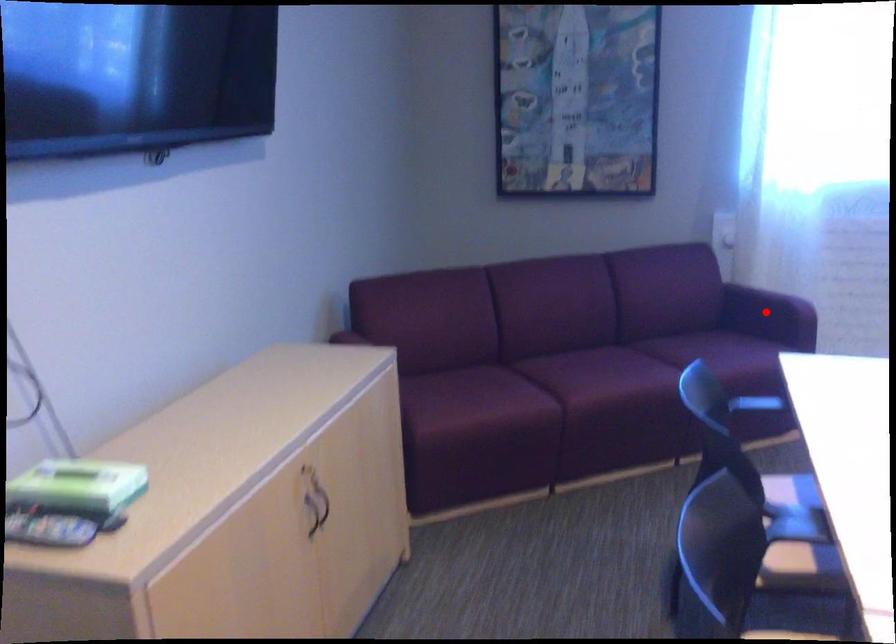
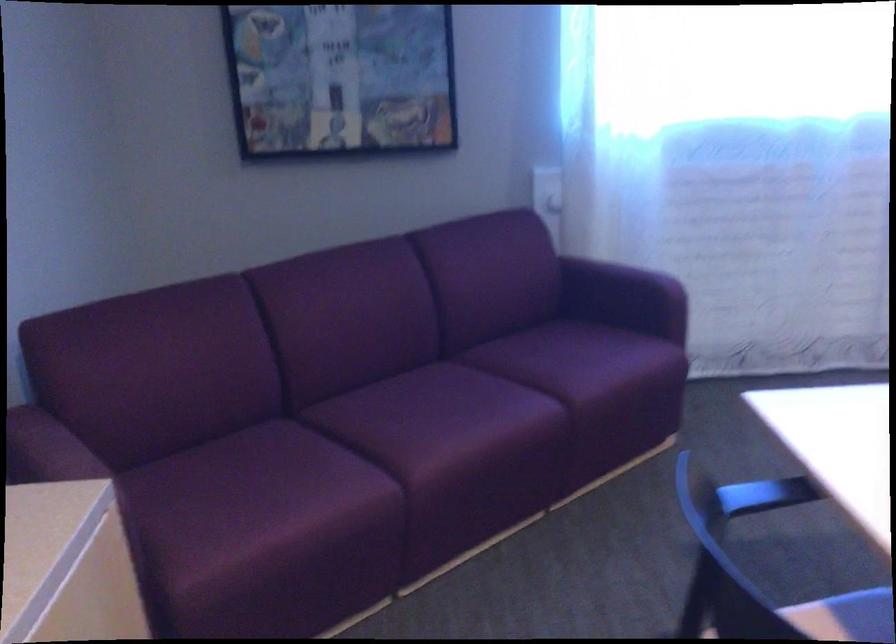
Find the pixel in the second image that matches the highlighted location in the first image.

(617, 289)